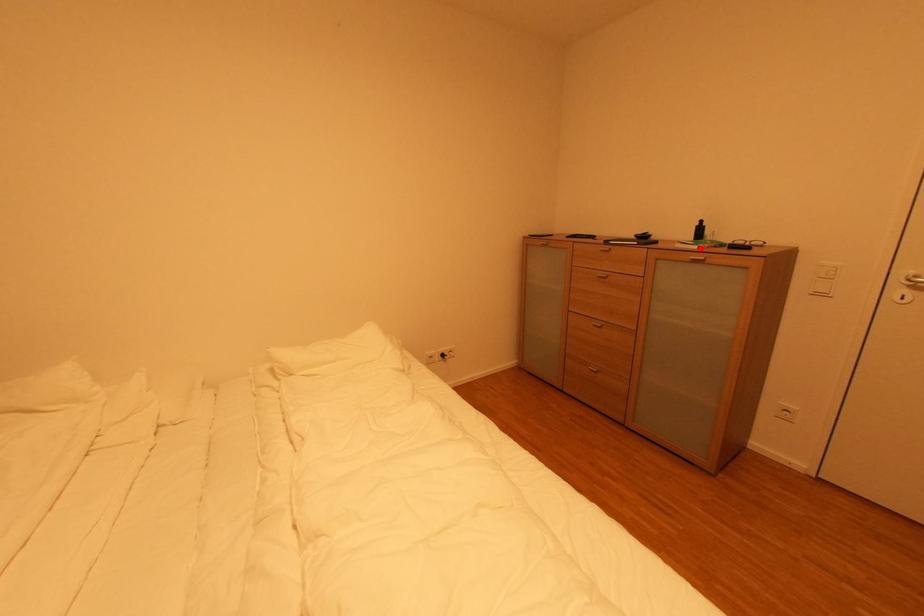
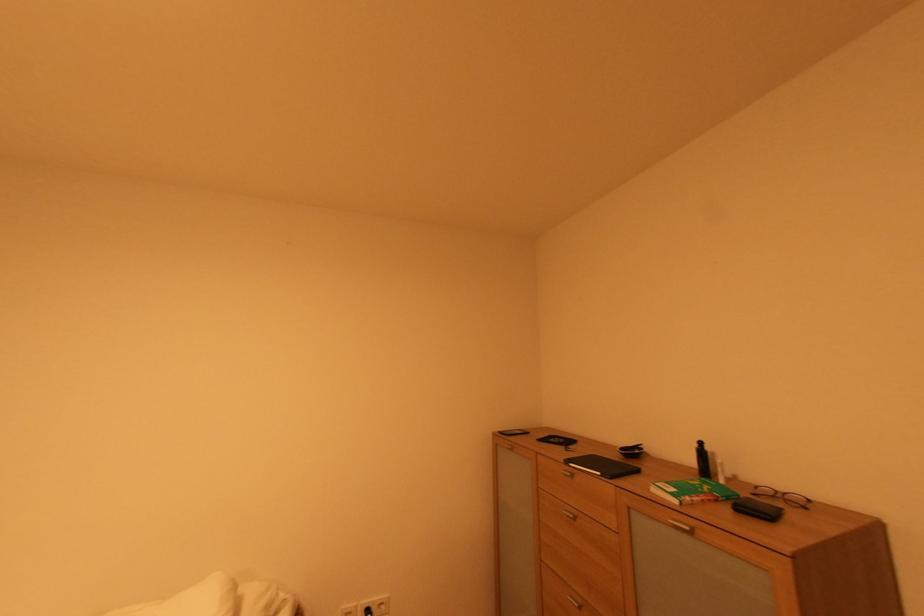
In the second image, find the point that corresponds to the highlighted location in the first image.

(682, 503)